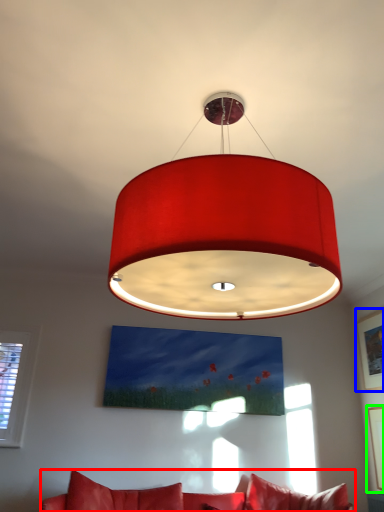
Question: Considering the real-world distances, which object is closest to studio couch (highlighted by a red box)? picture frame (highlighted by a blue box) or picture frame (highlighted by a green box).

Choices:
 (A) picture frame
 (B) picture frame

Answer: (B)